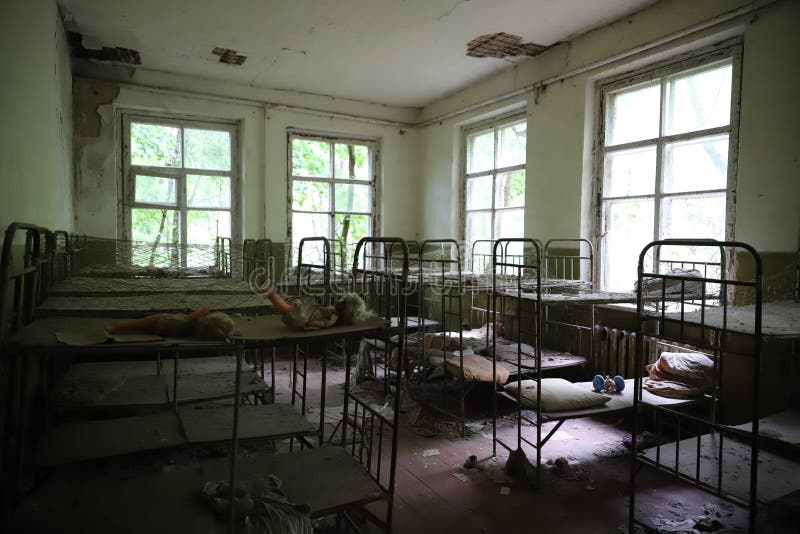
Locate an element on the screen. The image size is (800, 534). head of doll is located at coordinates (218, 329), (352, 309).